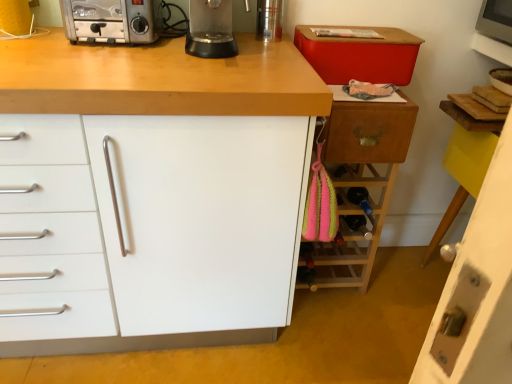
Question: Is white matte cabinet at center, arranged as the 1th cabinetry when viewed from the left, surrounded by wooden wine rack at right, arranged as the 2th cabinetry when viewed from the left?

Choices:
 (A) no
 (B) yes

Answer: (A)

Question: Does wooden wine rack at right, arranged as the 2th cabinetry when viewed from the left, appear on the right side of white matte cabinet at center, the 3th cabinetry in the right-to-left sequence?

Choices:
 (A) yes
 (B) no

Answer: (A)

Question: Considering the relative sizes of wooden wine rack at right, arranged as the 2th cabinetry when viewed from the left, and white matte cabinet at center, the 3th cabinetry in the right-to-left sequence, in the image provided, is wooden wine rack at right, arranged as the 2th cabinetry when viewed from the left, thinner than white matte cabinet at center, the 3th cabinetry in the right-to-left sequence,?

Choices:
 (A) no
 (B) yes

Answer: (B)

Question: From the image's perspective, is wooden wine rack at right, the 2th cabinetry positioned from the right, below white matte cabinet at center, the 3th cabinetry in the right-to-left sequence?

Choices:
 (A) no
 (B) yes

Answer: (B)

Question: Is wooden wine rack at right, arranged as the 2th cabinetry when viewed from the left, aimed at white matte cabinet at center, the 3th cabinetry in the right-to-left sequence?

Choices:
 (A) yes
 (B) no

Answer: (B)

Question: Considering the positions of point (456, 327) and point (202, 52), is point (456, 327) closer or farther from the camera than point (202, 52)?

Choices:
 (A) farther
 (B) closer

Answer: (B)

Question: Based on their positions, is white glossy door at lower right, the 1th cabinetry in the right-to-left sequence, located to the left or right of transparent plastic blender at center?

Choices:
 (A) right
 (B) left

Answer: (A)

Question: From a real-world perspective, is white glossy door at lower right, the third cabinetry in the left-to-right sequence, above or below transparent plastic blender at center?

Choices:
 (A) above
 (B) below

Answer: (B)

Question: Is white glossy door at lower right, the third cabinetry in the left-to-right sequence, bigger or smaller than transparent plastic blender at center?

Choices:
 (A) small
 (B) big

Answer: (B)

Question: In terms of height, does transparent plastic blender at center look taller or shorter compared to white matte cabinet at center, the 3th cabinetry in the right-to-left sequence?

Choices:
 (A) short
 (B) tall

Answer: (A)

Question: Would you say transparent plastic blender at center is inside or outside white matte cabinet at center, the 3th cabinetry in the right-to-left sequence?

Choices:
 (A) outside
 (B) inside

Answer: (A)

Question: Is transparent plastic blender at center bigger or smaller than white matte cabinet at center, the 3th cabinetry in the right-to-left sequence?

Choices:
 (A) small
 (B) big

Answer: (A)

Question: From the image's perspective, is transparent plastic blender at center located above or below white matte cabinet at center, the 3th cabinetry in the right-to-left sequence?

Choices:
 (A) above
 (B) below

Answer: (A)

Question: Which is correct: wooden wine rack at right, arranged as the 2th cabinetry when viewed from the left, is inside wooden drawer at right, or outside of it?

Choices:
 (A) inside
 (B) outside

Answer: (B)

Question: Considering the positions of point (304, 284) and point (392, 157), is point (304, 284) closer or farther from the camera than point (392, 157)?

Choices:
 (A) farther
 (B) closer

Answer: (A)